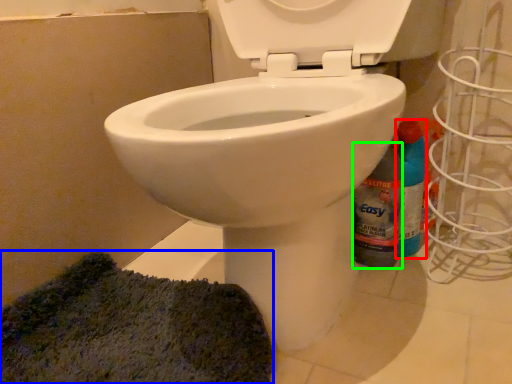
Question: Which object is positioned closest to cleaning product (highlighted by a red box)? Select from doormat (highlighted by a blue box) and bottle (highlighted by a green box).

Choices:
 (A) doormat
 (B) bottle

Answer: (B)